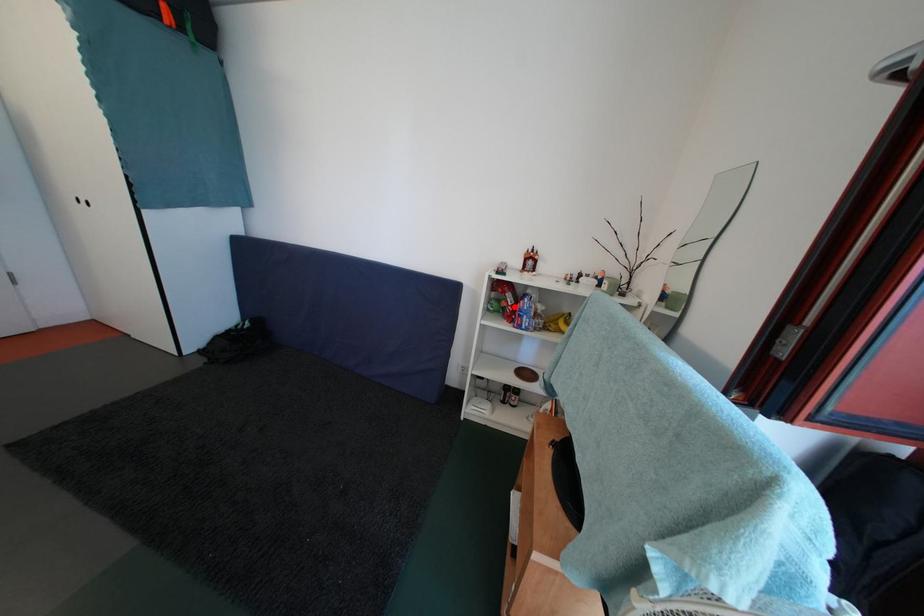
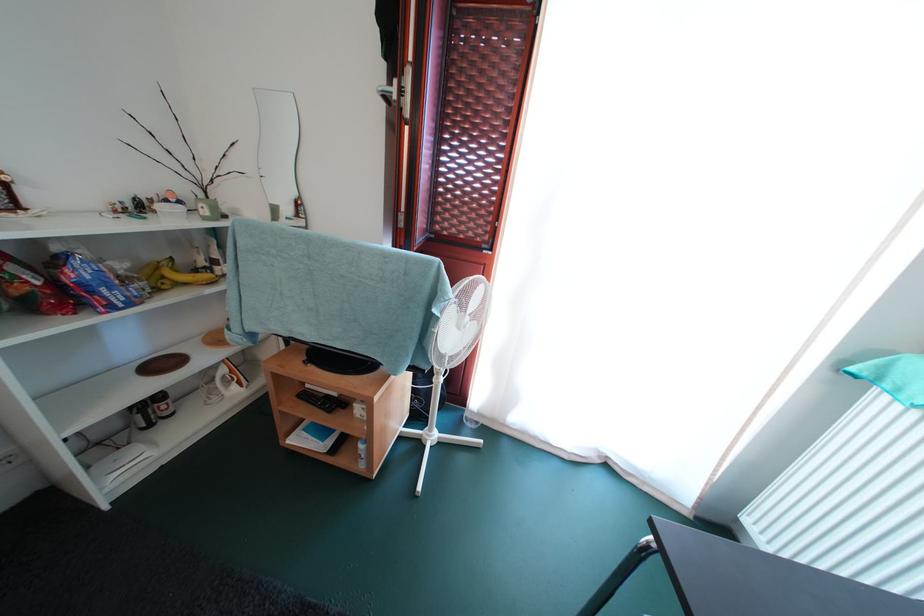
Where in the second image is the point corresponding to the highlighted location from the first image?

(34, 286)